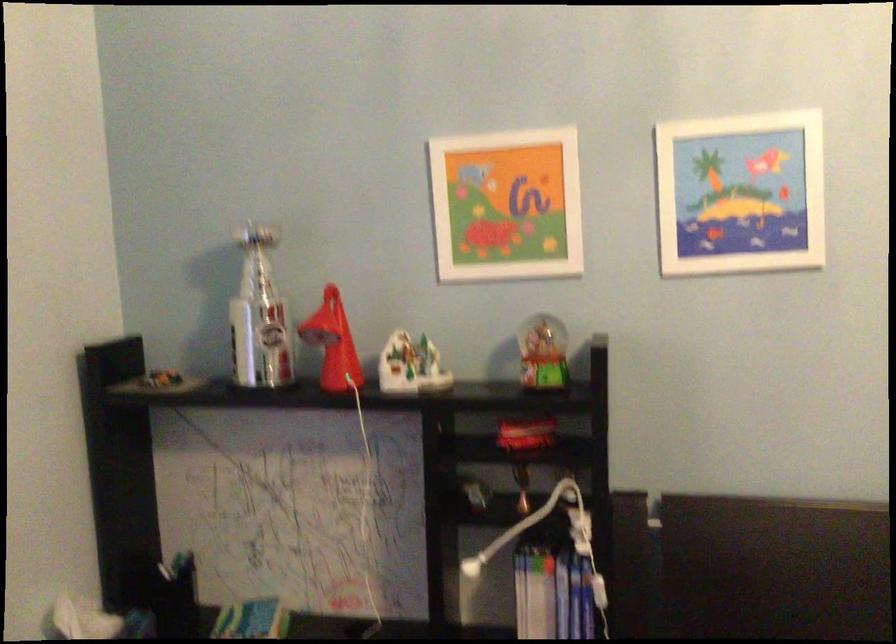
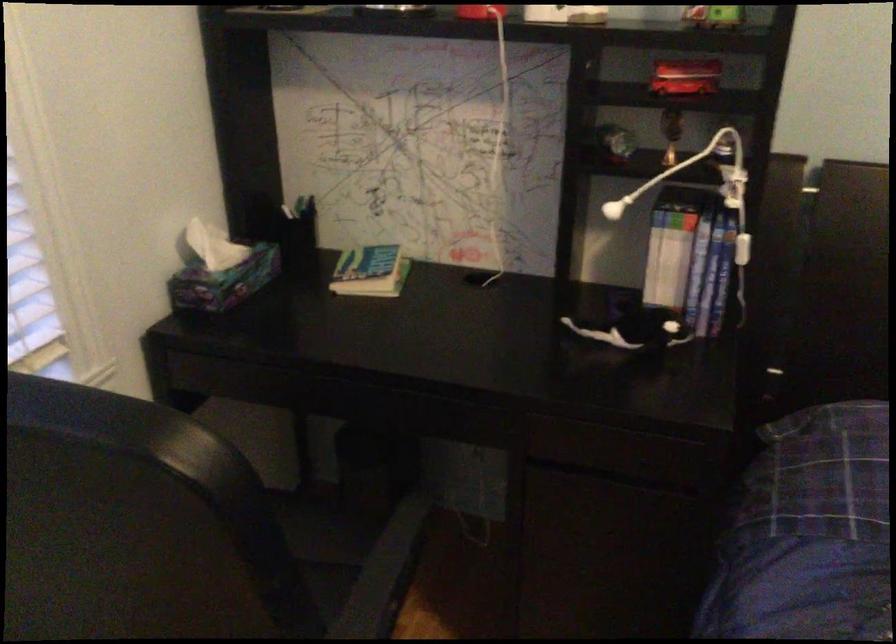
In the second image, find the point that corresponds to pixel 174 565 in the first image.

(295, 211)